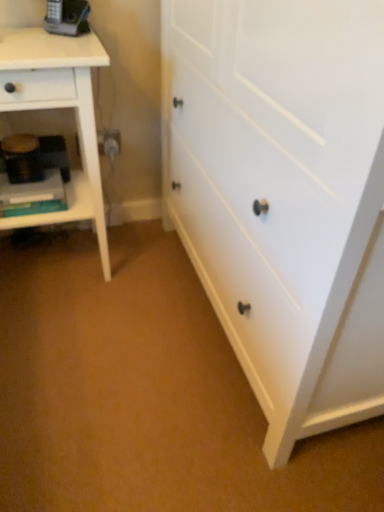
This screenshot has height=512, width=384. I want to click on vacant region to the left of white matte chest of drawers at center, so click(x=110, y=323).